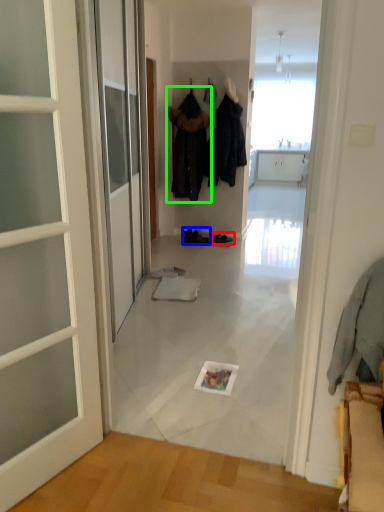
Question: Based on their relative distances, which object is nearer to footwear (highlighted by a red box)? Choose from footwear (highlighted by a blue box) and clothing (highlighted by a green box).

Choices:
 (A) footwear
 (B) clothing

Answer: (A)